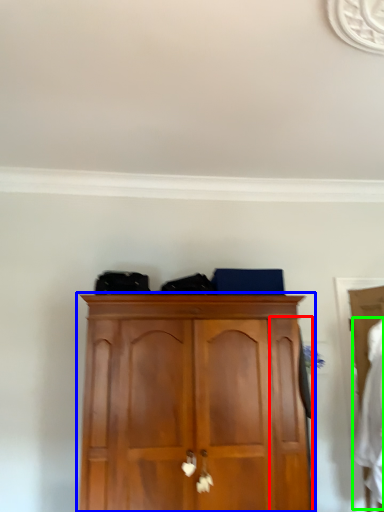
Question: Based on their relative distances, which object is nearer to door (highlighted by a red box)? Choose from cupboard (highlighted by a blue box) and clothing (highlighted by a green box).

Choices:
 (A) cupboard
 (B) clothing

Answer: (A)